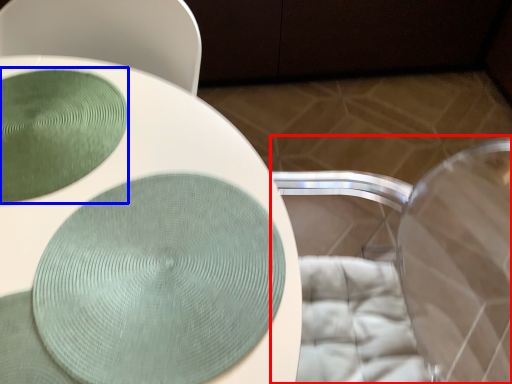
Question: Which point is further to the camera, swivel chair (highlighted by a red box) or glass plate (highlighted by a blue box)?

Choices:
 (A) swivel chair
 (B) glass plate

Answer: (B)